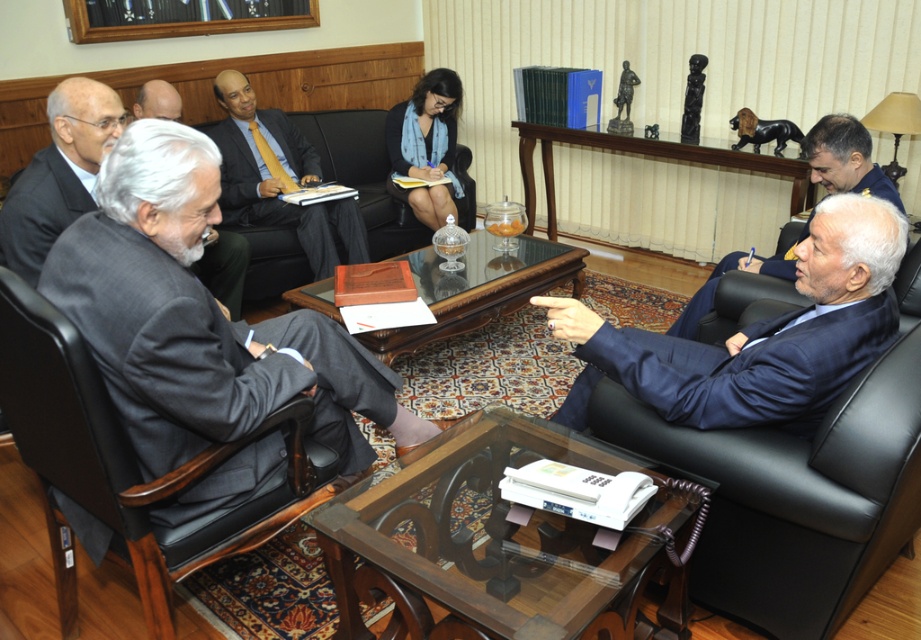
Is the position of dark gray leather armchair at left more distant than that of dark blue suit at right?

That is False.

The image size is (921, 640). Identify the location of dark gray leather armchair at left. (132, 452).

Find the location of a particular element. The height and width of the screenshot is (640, 921). black leather armchair at right is located at coordinates (799, 490).

Is black leather armchair at right below matte black suit at center?

Indeed, black leather armchair at right is positioned under matte black suit at center.

Does point (735, 566) come behind point (281, 122)?

That is False.

This screenshot has height=640, width=921. What are the coordinates of `black leather armchair at right` in the screenshot? It's located at point(799,490).

Is dark blue suit at right further to the viewer compared to bald head at upper left?

No, dark blue suit at right is closer to the viewer.

Who is positioned more to the left, dark blue suit at right or bald head at upper left?

Positioned to the left is bald head at upper left.

Between point (857, 124) and point (142, 115), which one is positioned behind?

Positioned behind is point (142, 115).

Find the location of a particular element. The image size is (921, 640). dark blue suit at right is located at coordinates (845, 157).